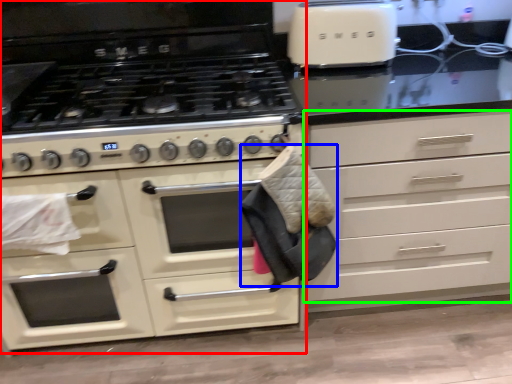
Question: Based on their relative distances, which object is nearer to cabinetry (highlighted by a red box)? Choose from material (highlighted by a blue box) and drawer (highlighted by a green box).

Choices:
 (A) material
 (B) drawer

Answer: (A)